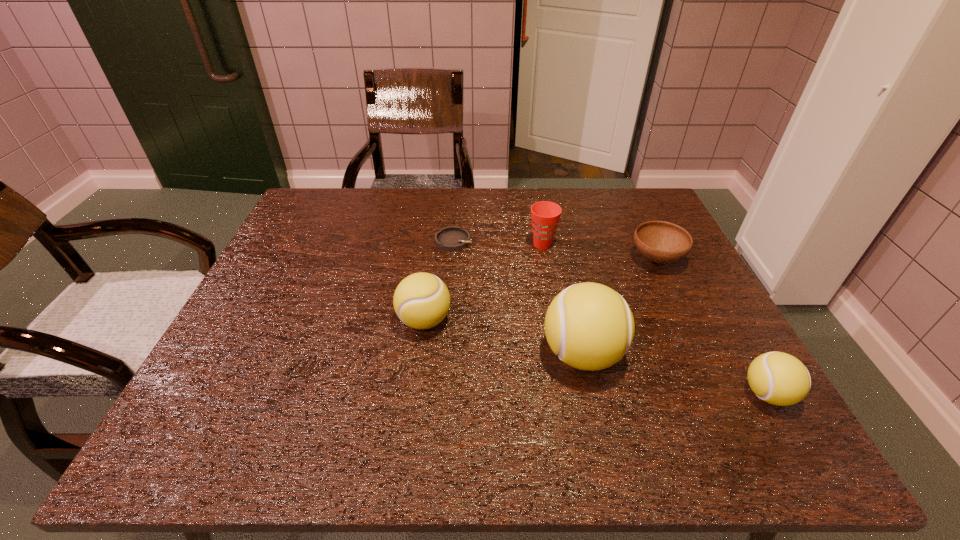
Locate an element on the screen. This screenshot has width=960, height=540. free spot located 0.280m on the back of the rightmost tennis ball is located at coordinates (703, 282).

The image size is (960, 540). I want to click on free point located on the left of the cup, so click(431, 245).

At what (x,y) coordinates should I click in order to perform the action: click on vacant space located on the front of the second shortest object. Please return your answer as a coordinate pair (x, y). Looking at the image, I should click on (683, 313).

Where is `free region located on the front of the ashtray`? This screenshot has width=960, height=540. free region located on the front of the ashtray is located at coordinates (451, 278).

You are a GUI agent. You are given a task and a screenshot of the screen. Output one action in this format:
    pyautogui.click(x=<x>, y=<y>)
    Task: Click on the tennis ball that is at the right edge
    This screenshot has width=960, height=540.
    Given the screenshot: What is the action you would take?
    pyautogui.click(x=778, y=378)

The width and height of the screenshot is (960, 540). What are the coordinates of `bowl that is at the right edge` in the screenshot? It's located at (662, 242).

The width and height of the screenshot is (960, 540). Identify the location of object that is at the near right corner. (778, 378).

What are the coordinates of `free space at the far edge of the desktop` in the screenshot? It's located at (429, 218).

Identify the location of free space at the near edge of the desktop. The image size is (960, 540). (379, 375).

You are a GUI agent. You are given a task and a screenshot of the screen. Output one action in this format:
    pyautogui.click(x=<x>, y=<y>)
    Task: Click on the vacant space at the left edge
    The height and width of the screenshot is (540, 960).
    Given the screenshot: What is the action you would take?
    pyautogui.click(x=317, y=282)